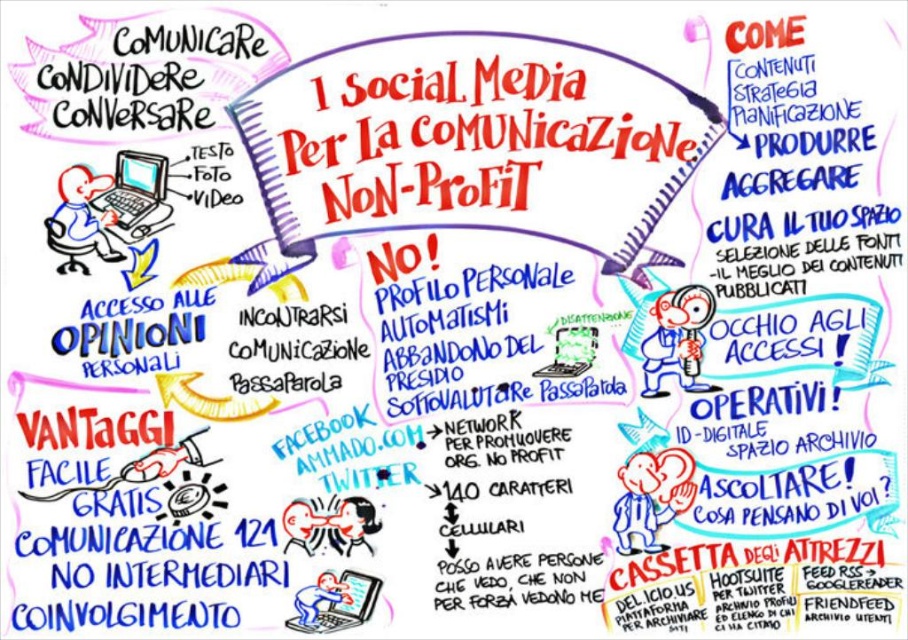
Locate an element on the screen. The height and width of the screenshot is (640, 908). matte blue laptop at left is located at coordinates (134, 193).

Which of these two, matte blue laptop at left or matte black laptop at lower left, stands taller?

matte blue laptop at left

Is point (130, 236) closer to camera compared to point (354, 605)?

Yes.

This screenshot has width=908, height=640. I want to click on matte blue laptop at left, so click(134, 193).